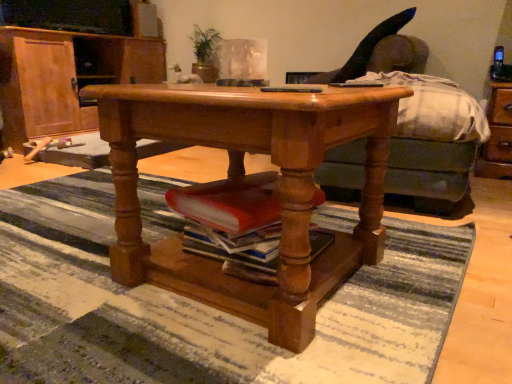
This screenshot has width=512, height=384. What do you see at coordinates (207, 307) in the screenshot?
I see `striped rug at center` at bounding box center [207, 307].

This screenshot has width=512, height=384. Find the location of `green leafy plant at upper center`. green leafy plant at upper center is located at coordinates (205, 53).

Image resolution: width=512 pixels, height=384 pixels. Describe the element at coordinates (205, 53) in the screenshot. I see `green leafy plant at upper center` at that location.

This screenshot has width=512, height=384. Describe the element at coordinates (365, 50) in the screenshot. I see `black leather swivel chair at upper right` at that location.

This screenshot has height=384, width=512. What do you see at coordinates (292, 89) in the screenshot?
I see `black plastic remote control at center` at bounding box center [292, 89].

This screenshot has height=384, width=512. Find the location of `wooden table at center`. wooden table at center is located at coordinates (252, 185).

Which of these two, black plastic remote control at center or green leafy plant at upper center, is thinner?

Thinner between the two is black plastic remote control at center.

Considering the positions of objects black plastic remote control at center and green leafy plant at upper center in the image provided, who is more to the right, black plastic remote control at center or green leafy plant at upper center?

black plastic remote control at center.

Consider the image. From the image's perspective, which object appears higher, black plastic remote control at center or green leafy plant at upper center?

green leafy plant at upper center is shown above in the image.

Does point (271, 87) appear closer or farther from the camera than point (192, 36)?

Clearly, point (271, 87) is closer to the camera than point (192, 36).

Which is more to the left, green leafy plant at upper center or green fabric couch at center?

green leafy plant at upper center is more to the left.

Which of these two, green leafy plant at upper center or green fabric couch at center, is smaller?

Smaller between the two is green leafy plant at upper center.

This screenshot has width=512, height=384. Find the location of `studio couch in front of the green leafy plant at upper center`. studio couch in front of the green leafy plant at upper center is located at coordinates (431, 175).

Considering the positions of objects green leafy plant at upper center and green fabric couch at center in the image provided, who is behind, green leafy plant at upper center or green fabric couch at center?

Positioned behind is green leafy plant at upper center.

Which point is more distant from viewer, (154,51) or (498,100)?

The point (154,51) is farther from the camera.

Between wooden cabinet at left and brown wooden dresser at right, which one has more height?

Standing taller between the two is wooden cabinet at left.

Would you say brown wooden dresser at right is part of wooden cabinet at left's contents?

That's incorrect, brown wooden dresser at right is not inside wooden cabinet at left.

Considering the sizes of objects black plastic remote control at center and wooden cabinet at left in the image provided, who is shorter, black plastic remote control at center or wooden cabinet at left?

black plastic remote control at center is shorter.

Could you tell me if black plastic remote control at center is facing wooden cabinet at left?

No, black plastic remote control at center is not turned towards wooden cabinet at left.

Is black plastic remote control at center completely or partially outside of wooden cabinet at left?

black plastic remote control at center is positioned outside wooden cabinet at left.

Which is more to the left, black plastic remote control at center or wooden cabinet at left?

wooden cabinet at left.

Relative to green leafy plant at upper center, is wooden cabinet at left in front or behind?

wooden cabinet at left is in front of green leafy plant at upper center.

Could you tell me if wooden cabinet at left is turned towards green leafy plant at upper center?

No, wooden cabinet at left is not oriented towards green leafy plant at upper center.

Is point (99, 74) behind point (201, 42)?

Yes, point (99, 74) is behind point (201, 42).

Looking at this image, are wooden cabinet at left and green leafy plant at upper center located far from each other?

That's not correct — wooden cabinet at left is a little close to green leafy plant at upper center.

From the image's perspective, is black plastic remote control at center under striped rug at center?

Actually, black plastic remote control at center appears above striped rug at center in the image.

In terms of height, does black plastic remote control at center look taller or shorter compared to striped rug at center?

In the image, black plastic remote control at center appears to be shorter than striped rug at center.

Is striped rug at center at the back of black plastic remote control at center?

That's not correct — black plastic remote control at center is not looking away from striped rug at center.

I want to click on mat below the green fabric couch at center (from the image's perspective), so click(x=207, y=307).

Between green fabric couch at center and striped rug at center, which one has less height?

striped rug at center.

Does green fabric couch at center appear on the left side of striped rug at center?

No.

Considering the relative sizes of green fabric couch at center and striped rug at center in the image provided, is green fabric couch at center thinner than striped rug at center?

Yes, green fabric couch at center is thinner than striped rug at center.

The image size is (512, 384). What are the coordinates of `houseplant on the left of black plastic remote control at center` in the screenshot? It's located at (205, 53).

This screenshot has width=512, height=384. In order to click on studio couch below the green leafy plant at upper center (from the image's perspective) in this screenshot , I will do `click(431, 175)`.

Looking at the image, which one is located further to black leather swivel chair at upper right, brown wooden dresser at right or green leafy plant at upper center?

Among the two, green leafy plant at upper center is located further to black leather swivel chair at upper right.

In the scene shown: From the image, which object appears to be farther from brown wooden dresser at right, striped rug at center or wooden cabinet at left?

wooden cabinet at left is positioned further to the anchor brown wooden dresser at right.

From the image, which object appears to be farther from black leather swivel chair at upper right, wooden table at center or black plastic remote control at center?

wooden table at center is positioned further to the anchor black leather swivel chair at upper right.

Looking at the image, which one is located closer to black plastic remote control at center, brown wooden dresser at right or striped rug at center?

striped rug at center.

Consider the image. Which object lies nearer to the anchor point green fabric couch at center, brown wooden dresser at right or green leafy plant at upper center?

The object closer to green fabric couch at center is brown wooden dresser at right.

From the image, which object appears to be nearer to striped rug at center, wooden table at center or brown wooden dresser at right?

wooden table at center is positioned closer to the anchor striped rug at center.

From the image, which object appears to be farther from black plastic remote control at center, black leather swivel chair at upper right or brown wooden dresser at right?

brown wooden dresser at right is further to black plastic remote control at center.

Considering their positions, is wooden table at center positioned further to green fabric couch at center than brown wooden dresser at right?

brown wooden dresser at right is positioned further to the anchor green fabric couch at center.

At what (x,y) coordinates should I click in order to perform the action: click on remote control between wooden table at center and green leafy plant at upper center in the front-back direction. Please return your answer as a coordinate pair (x, y). The image size is (512, 384). Looking at the image, I should click on (292, 89).

Image resolution: width=512 pixels, height=384 pixels. What are the coordinates of `studio couch between striped rug at center and brown wooden dresser at right in the horizontal direction` in the screenshot? It's located at (431, 175).

Where is `remote control situated between wooden cabinet at left and black leather swivel chair at upper right from left to right`? remote control situated between wooden cabinet at left and black leather swivel chair at upper right from left to right is located at coordinates (292, 89).

Identify the location of houseplant situated between wooden cabinet at left and brown wooden dresser at right from left to right. This screenshot has height=384, width=512. (205, 53).